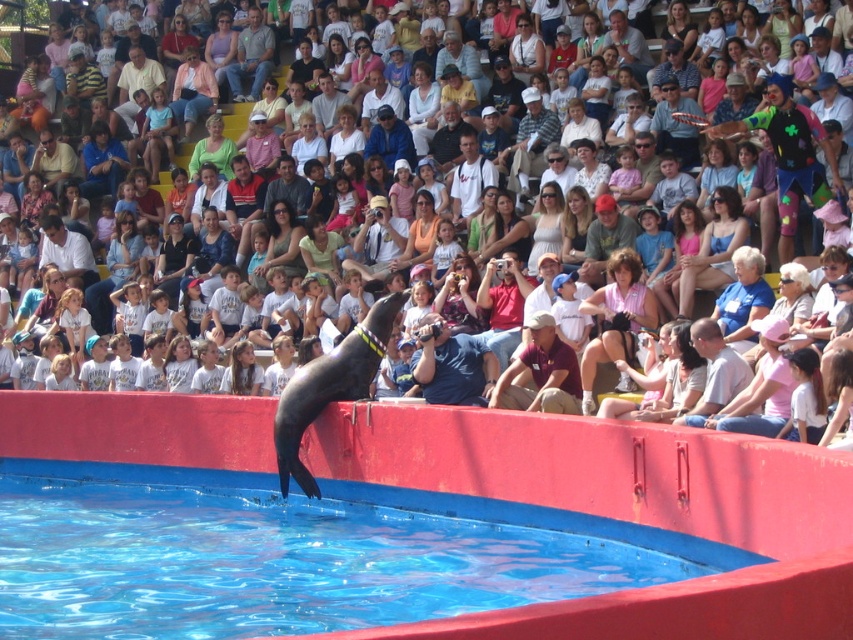
Question: Estimate the real-world distances between objects in this image. Which object is closer to the matte black seal at center?

Choices:
 (A) blue shirt at center
 (B) blue smooth water at center

Answer: (A)

Question: Which object is farther from the camera taking this photo?

Choices:
 (A) blue shirt at center
 (B) blue smooth water at center
 (C) matte black seal at center

Answer: (C)

Question: Estimate the real-world distances between objects in this image. Which object is farther from the blue shirt at center?

Choices:
 (A) blue smooth water at center
 (B) matte black seal at center

Answer: (A)

Question: Does blue smooth water at center lie behind matte black seal at center?

Choices:
 (A) no
 (B) yes

Answer: (A)

Question: Can you confirm if blue shirt at center is thinner than matte black seal at center?

Choices:
 (A) yes
 (B) no

Answer: (A)

Question: Can you confirm if blue smooth water at center is positioned to the left of blue shirt at center?

Choices:
 (A) yes
 (B) no

Answer: (A)